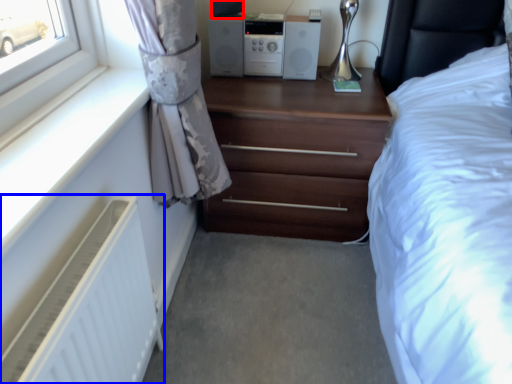
Question: Which point is closer to the camera, speaker (highlighted by a red box) or radiator (highlighted by a blue box)?

Choices:
 (A) speaker
 (B) radiator

Answer: (B)